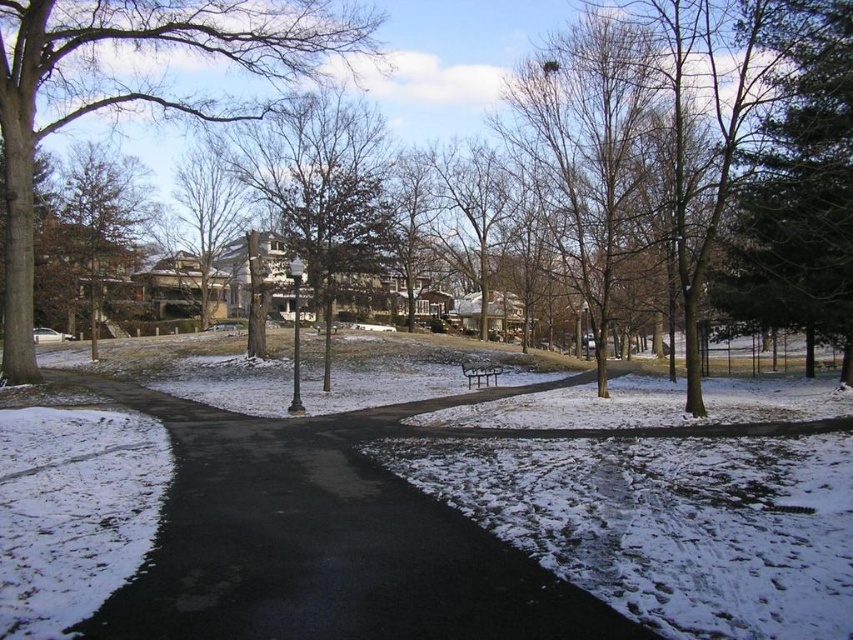
Is point (827, 336) farther from camera compared to point (93, 163)?

That is False.

Where is `dark green textured evergreen tree at right`? The height and width of the screenshot is (640, 853). dark green textured evergreen tree at right is located at coordinates (799, 188).

Is brown textured tree at center positioned in front of green matte tree at upper left?

That is True.

From the picture: Who is more forward, [326,100] or [80,237]?

Positioned in front is point [326,100].

Where is `brown textured tree at center`? The width and height of the screenshot is (853, 640). brown textured tree at center is located at coordinates (320, 184).

Between brown textured tree at upper left and green matte tree at upper left, which one appears on the left side from the viewer's perspective?

Positioned to the left is green matte tree at upper left.

Does point (318, 36) lie behind point (71, 200)?

No.

Who is more forward, (25,4) or (144,221)?

Point (25,4) is more forward.

I want to click on brown textured tree at upper left, so click(x=131, y=88).